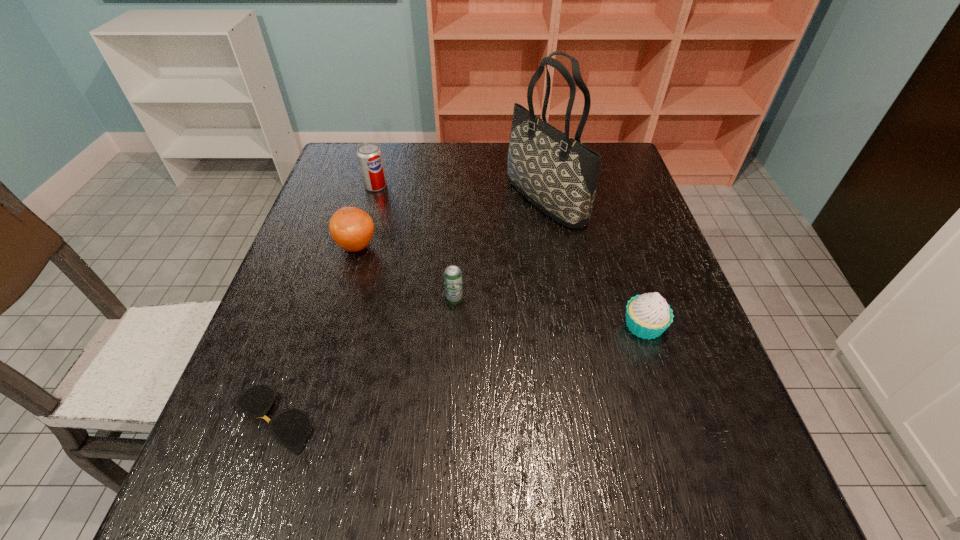
Identify the location of vacant area located on the front of the tallest object. click(571, 352).

Locate an element on the screen. vacant position located on the back of the soda is located at coordinates (384, 158).

This screenshot has width=960, height=540. I want to click on free space located on the back of the orange, so click(373, 186).

Where is `free space located 0.050m on the back of the second nearest object`? This screenshot has width=960, height=540. free space located 0.050m on the back of the second nearest object is located at coordinates (633, 292).

Locate an element on the screen. Image resolution: width=960 pixels, height=540 pixels. free space located on the right of the third nearest object is located at coordinates (486, 301).

Identify the location of free location located on the back of the nearest object. The width and height of the screenshot is (960, 540). (304, 320).

Image resolution: width=960 pixels, height=540 pixels. What are the coordinates of `tote bag present at the far edge` in the screenshot? It's located at (557, 174).

At what (x,y) coordinates should I click in order to perform the action: click on soda situated at the far edge. Please return your answer as a coordinate pair (x, y). The height and width of the screenshot is (540, 960). Looking at the image, I should click on (369, 154).

Where is `soda that is at the left edge`? Image resolution: width=960 pixels, height=540 pixels. soda that is at the left edge is located at coordinates (369, 154).

You are a GUI agent. You are given a task and a screenshot of the screen. Output one action in this format:
    pyautogui.click(x=<x>, y=<y>)
    Task: Click on the orange positioned at the left edge
    The height and width of the screenshot is (540, 960).
    Given the screenshot: What is the action you would take?
    pyautogui.click(x=351, y=228)